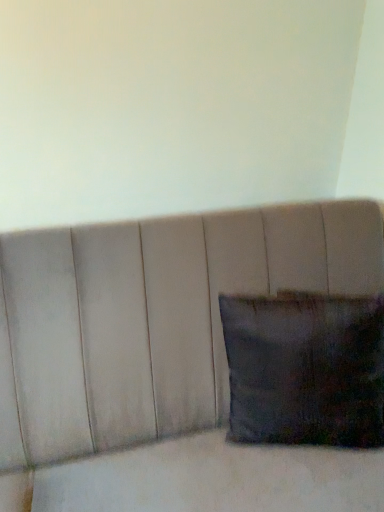
Identify the location of free space above dark fabric pillow at lower right (from a real-world perspective). The width and height of the screenshot is (384, 512). (339, 311).